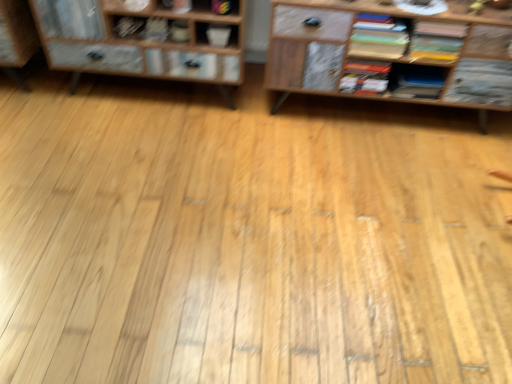
This screenshot has height=384, width=512. I want to click on vacant point above multicolored paper stack at upper right, the 4th book from the left (from a real-world perspective), so click(x=384, y=13).